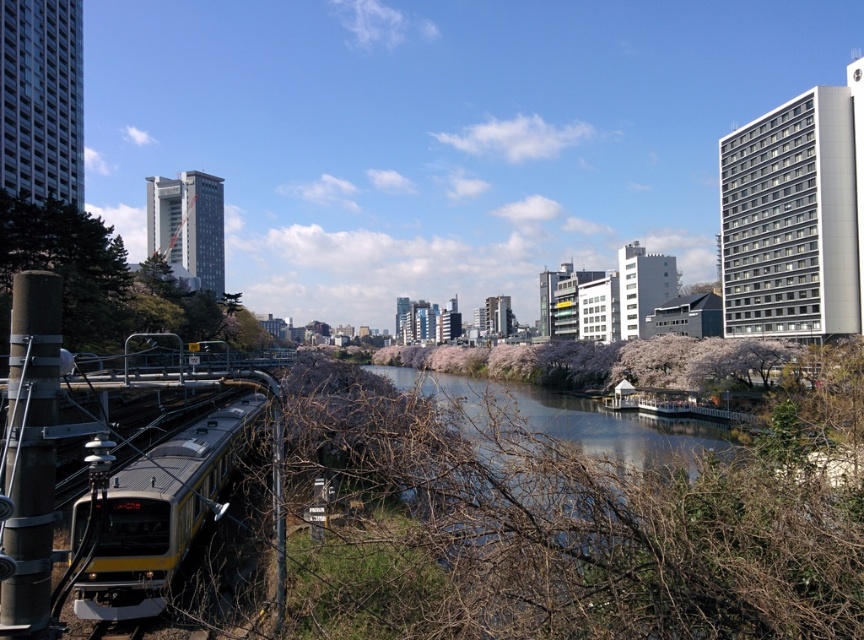
Question: Does yellow metallic train at lower left have a larger size compared to green leafy tree at left?

Choices:
 (A) yes
 (B) no

Answer: (B)

Question: Considering the relative positions of yellow metallic train at lower left and green leafy tree at left in the image provided, where is yellow metallic train at lower left located with respect to green leafy tree at left?

Choices:
 (A) above
 (B) below

Answer: (B)

Question: Which object appears farthest from the camera in this image?

Choices:
 (A) green leafy tree at left
 (B) yellow metallic train at lower left

Answer: (A)

Question: Which of the following is the farthest from the observer?

Choices:
 (A) green leafy tree at left
 (B) yellow metallic train at lower left

Answer: (A)

Question: Can you confirm if yellow metallic train at lower left is thinner than green leafy tree at left?

Choices:
 (A) no
 (B) yes

Answer: (B)